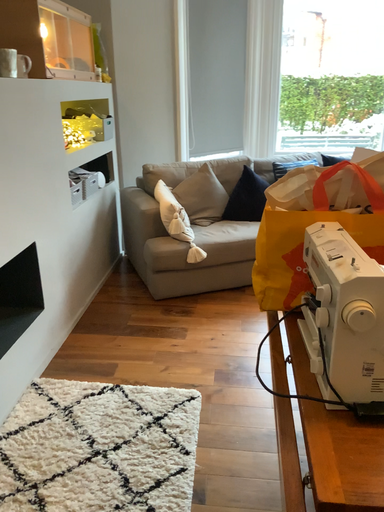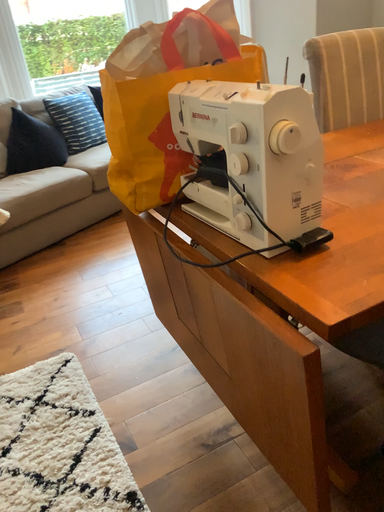
Question: How did the camera likely rotate when shooting the video?

Choices:
 (A) rotated left
 (B) rotated right

Answer: (B)